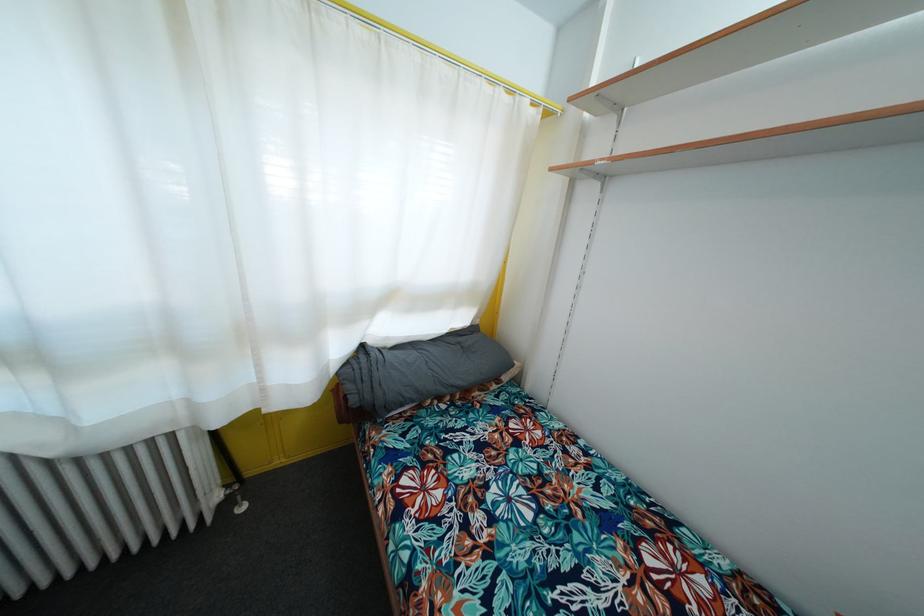
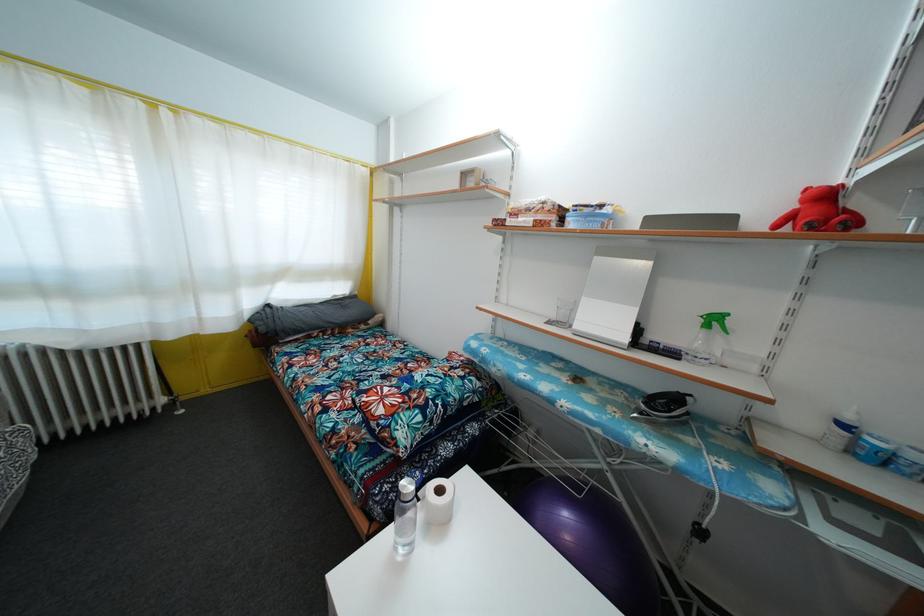
The point at (x=481, y=329) is marked in the first image. Where is the corresponding point in the second image?

(359, 300)